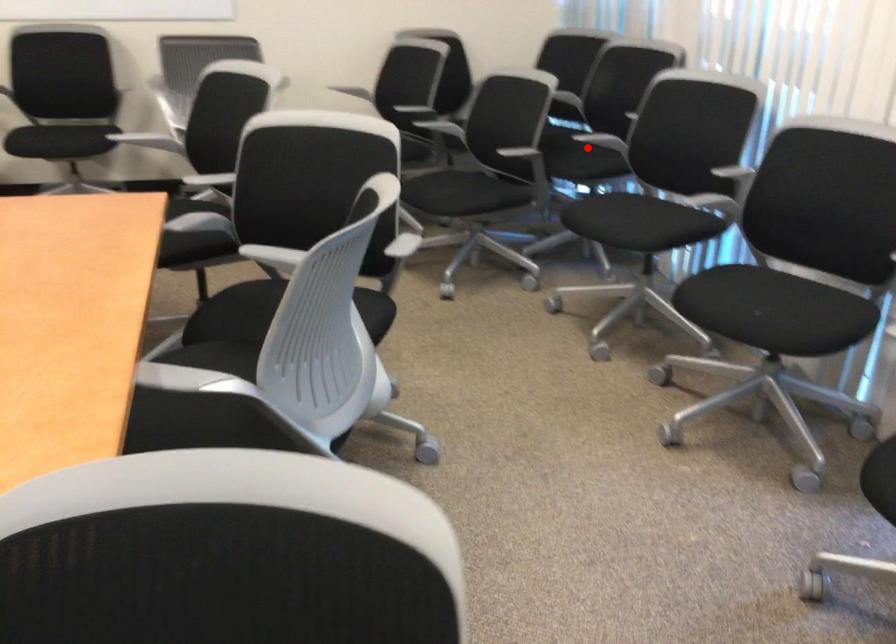
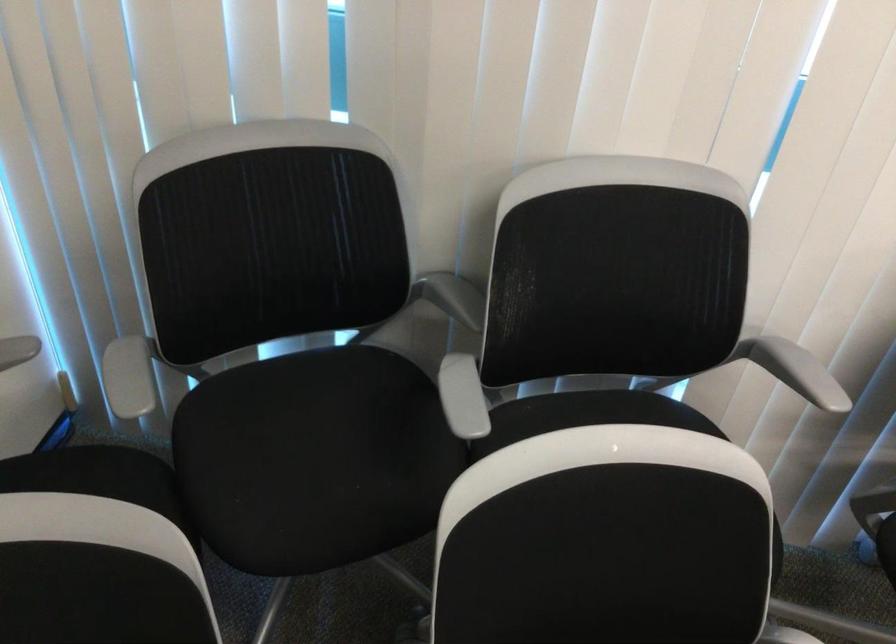
Question: I am providing you with two images of the same scene from different viewpoints. A red point is marked on the first image. Can you still see the location of the red point in image 2?

Choices:
 (A) Yes
 (B) No

Answer: (B)